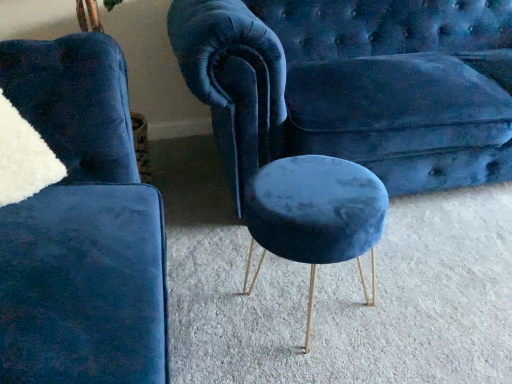
Find the location of `vacant point to the left of velvet blue stool at center`. vacant point to the left of velvet blue stool at center is located at coordinates (207, 291).